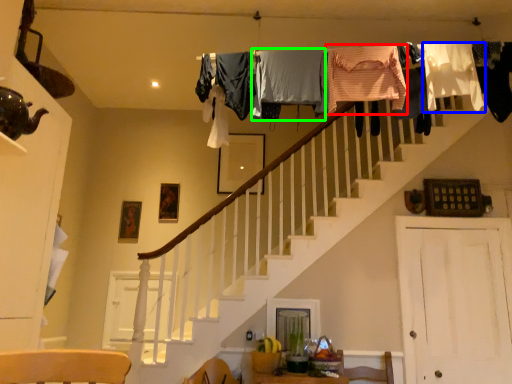
Question: Considering the real-world distances, which object is closest to clothing (highlighted by a red box)? clothing (highlighted by a blue box) or clothing (highlighted by a green box).

Choices:
 (A) clothing
 (B) clothing

Answer: (B)